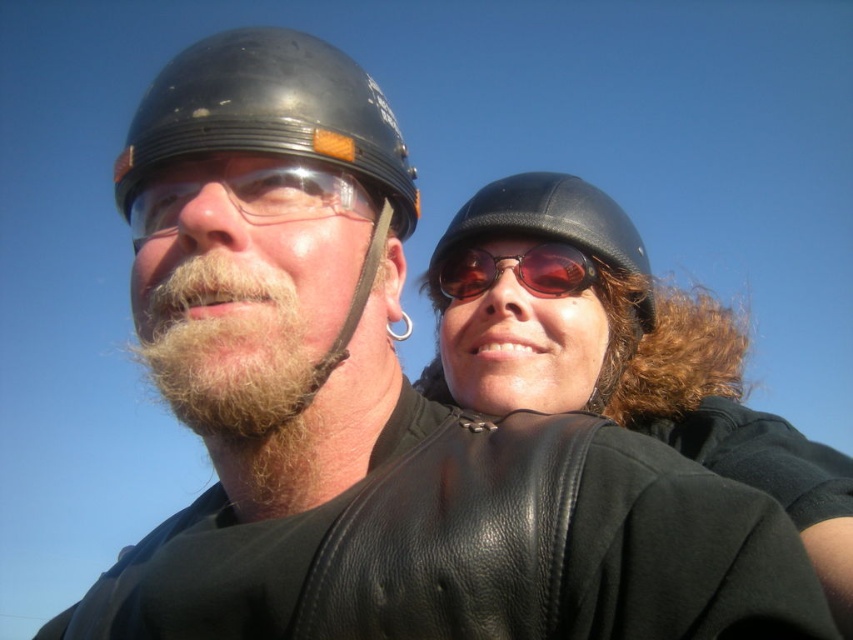
Does matte black helmet at upper right have a smaller size compared to glossy black helmet at left?

No.

Is matte black helmet at upper right shorter than glossy black helmet at left?

No.

Find the location of `matte black helmet at upper right`. matte black helmet at upper right is located at coordinates (616, 349).

At what (x,y) coordinates should I click in order to perform the action: click on matte black helmet at upper right. Please return your answer as a coordinate pair (x, y). Looking at the image, I should click on (616, 349).

Which of these two, fuzzy brown beard at center or matte black goggles at left, stands shorter?

With less height is matte black goggles at left.

Does fuzzy brown beard at center lie behind matte black goggles at left?

Yes, fuzzy brown beard at center is behind matte black goggles at left.

Is point (223, 381) more distant than point (183, 180)?

Yes, it is.

Where is `fuzzy brown beard at center`? fuzzy brown beard at center is located at coordinates click(229, 348).

Does point (239, 168) come closer to viewer compared to point (515, 272)?

Yes, point (239, 168) is in front of point (515, 272).

Can you confirm if matte black goggles at left is positioned below matte brown sunglasses at center?

Incorrect, matte black goggles at left is not positioned below matte brown sunglasses at center.

Does point (259, 205) come in front of point (436, 273)?

That is True.

Locate an element on the screen. matte black goggles at left is located at coordinates (248, 193).